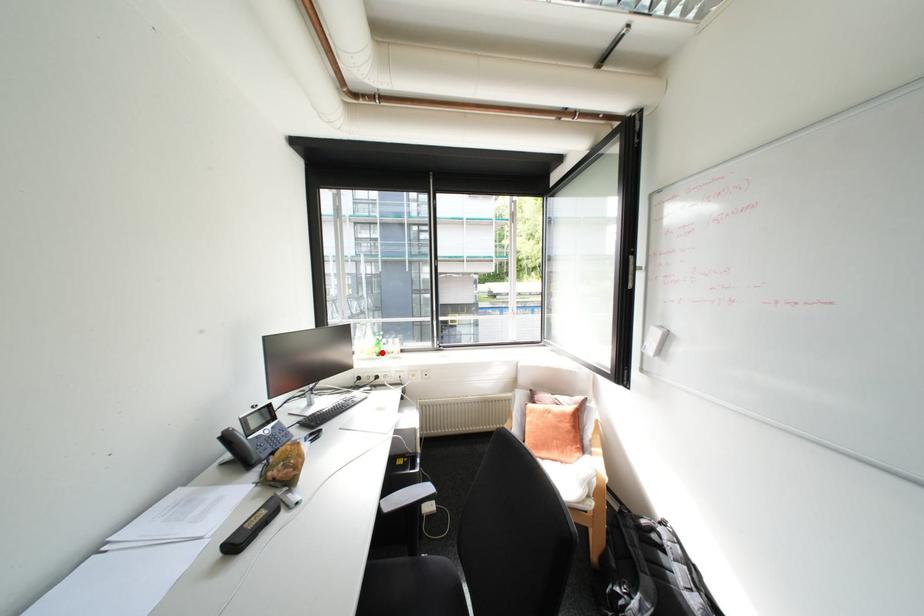
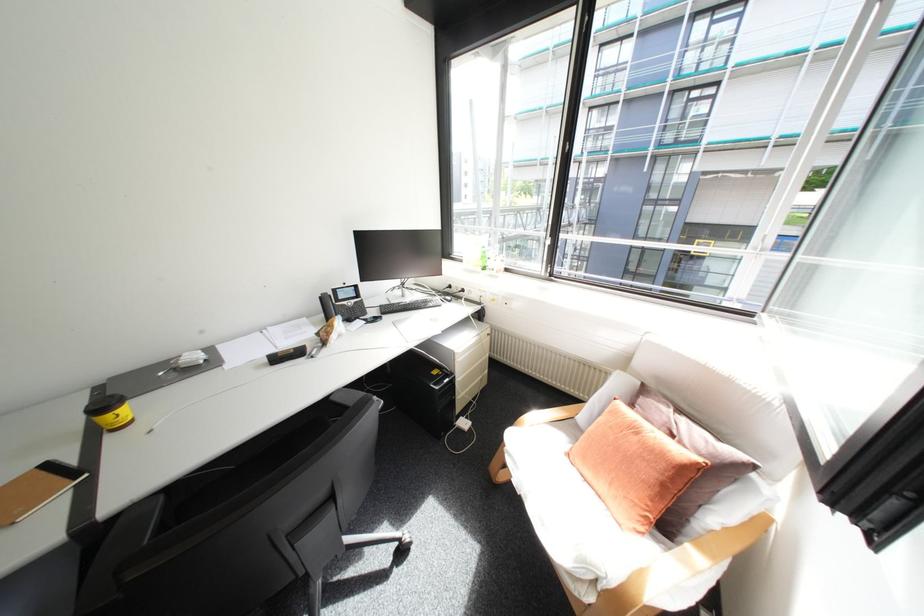
Question: A red point is marked in image1. In image2, is the corresponding 3D point closer to the camera or farther? Reply with the corresponding letter.

Choices:
 (A) The corresponding 3D point is closer.
 (B) The corresponding 3D point is farther.

Answer: (A)